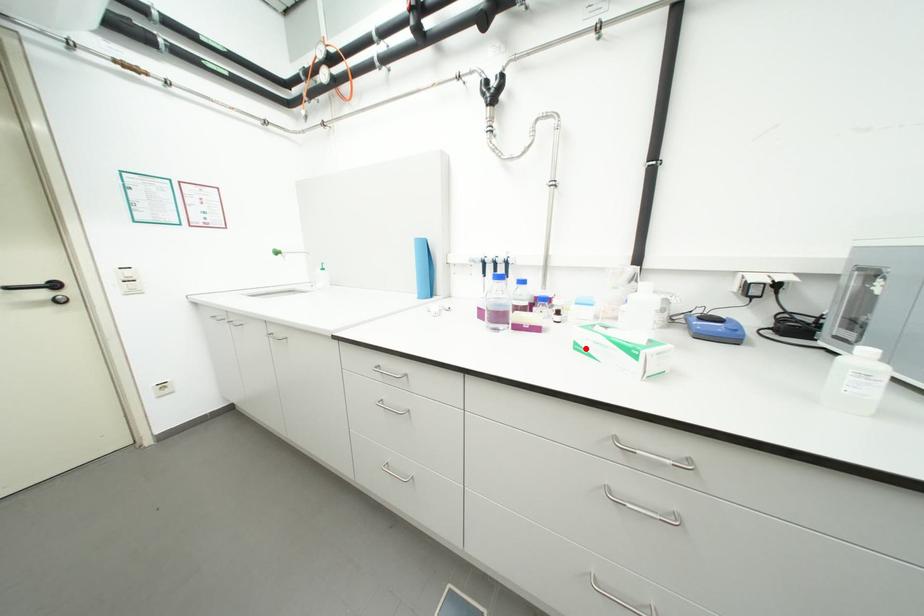
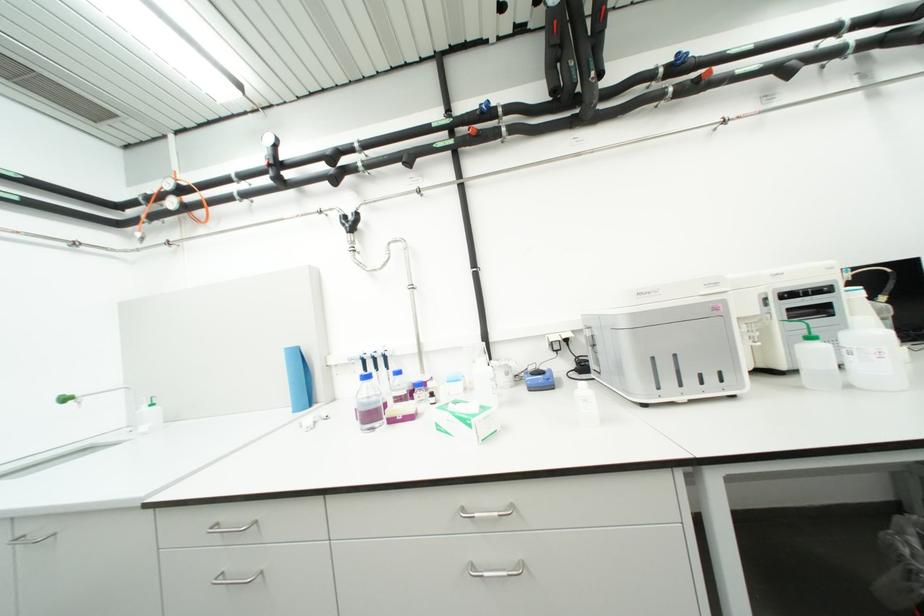
Where in the second image is the point corresponding to the highlighted location from the first image?

(446, 429)